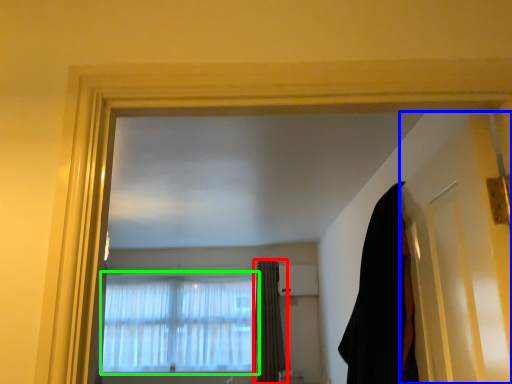
Question: Which is farther away from curtain (highlighted by a red box)? door (highlighted by a blue box) or window (highlighted by a green box)?

Choices:
 (A) door
 (B) window

Answer: (A)